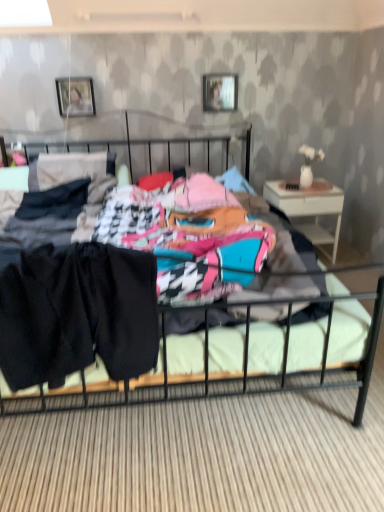
Question: Looking at their shapes, would you say black fabric shorts at center is wider or thinner than metallic silver picture frame at upper center, the 1th picture frame from the right?

Choices:
 (A) wide
 (B) thin

Answer: (A)

Question: Visually, is black fabric shorts at center positioned to the left or to the right of metallic silver picture frame at upper center, which is the 2th picture frame from left to right?

Choices:
 (A) left
 (B) right

Answer: (A)

Question: Considering the real-world distances, which object is closest to the white wood nightstand at right?

Choices:
 (A) matte silver picture frame at upper center, the 2th picture frame viewed from the right
 (B) black fabric shorts at center
 (C) metallic silver picture frame at upper center, the 1th picture frame from the right
 (D) black fabric bed at center

Answer: (C)

Question: Which is farther from the metallic silver picture frame at upper center, the 1th picture frame from the right?

Choices:
 (A) black fabric shorts at center
 (B) black fabric bed at center
 (C) matte silver picture frame at upper center, positioned as the first picture frame in left-to-right order
 (D) white wood nightstand at right

Answer: (A)